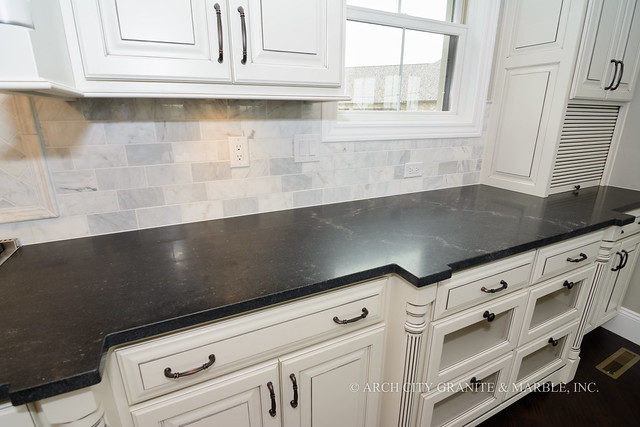
Where is `black countertop`? The width and height of the screenshot is (640, 427). black countertop is located at coordinates (111, 294), (422, 236).